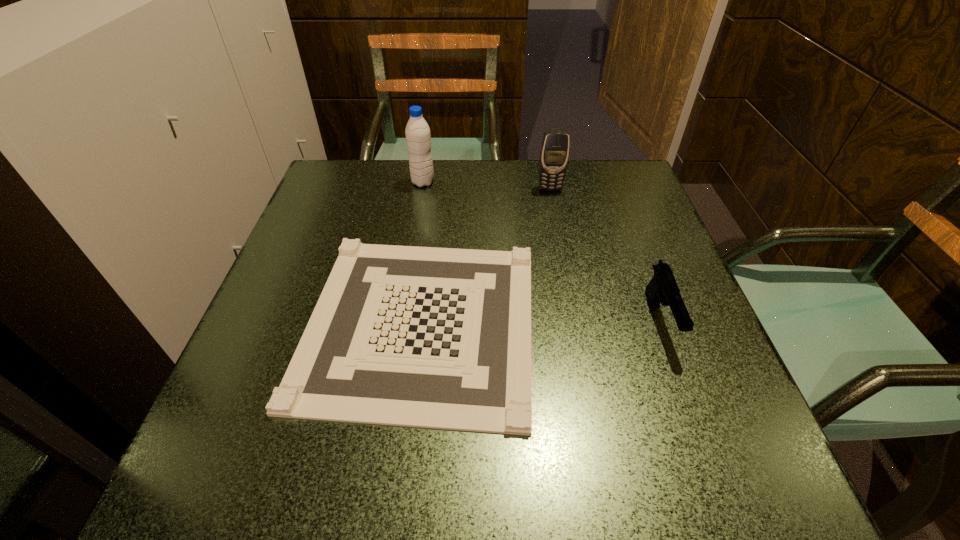
Locate which object ranks in proximity to the tallest object. Please provide its 2D coordinates. Your answer should be formatted as a tuple, i.e. [(x, y)], where the tuple contains the x and y coordinates of a point satisfying the conditions above.

[(428, 337)]

At what (x,y) coordinates should I click in order to perform the action: click on free region that satisfies the following two spatial constraints: 1. on the front side of the water bottle; 2. on the right side of the shortest object. Please return your answer as a coordinate pair (x, y). This screenshot has height=540, width=960. Looking at the image, I should click on (400, 322).